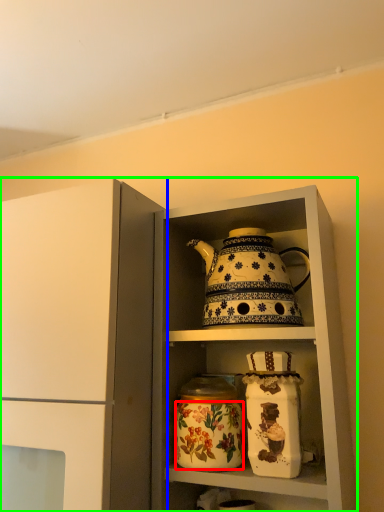
Question: Which object is positioned closest to flower (highlighted by a red box)? Select from cupboard (highlighted by a blue box) and cabinetry (highlighted by a green box).

Choices:
 (A) cupboard
 (B) cabinetry

Answer: (B)